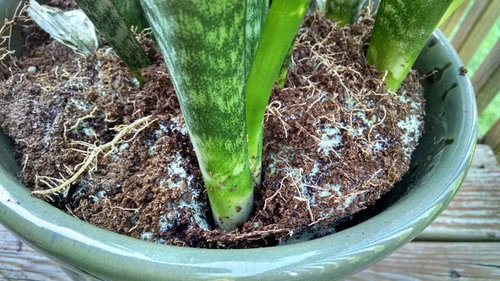
Where is `dirt on the rim of the pot`? The width and height of the screenshot is (500, 281). dirt on the rim of the pot is located at coordinates pos(463,72).